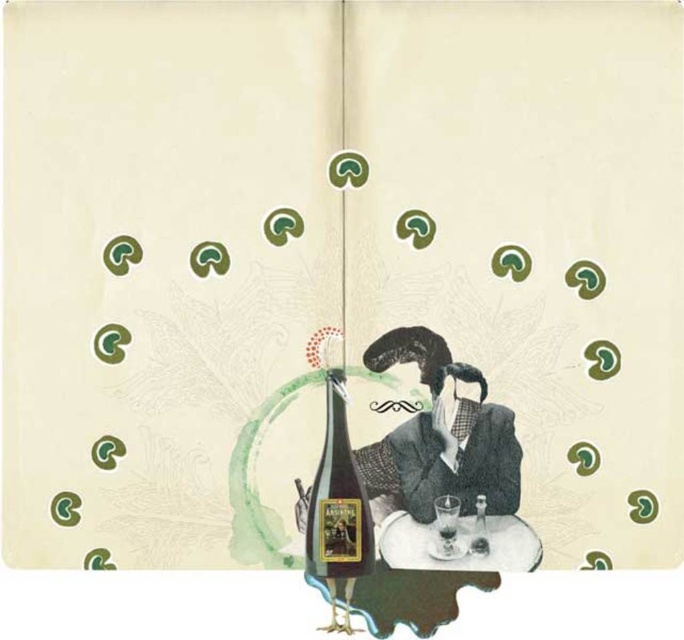
You are an artist analyzing the composition of this image. You notice the white wood table at center and the transparent glass at center. According to the spatial arrangement, which object is positioned to the right of the other?

The white wood table at center is to the right of the transparent glass at center.

You are a bartender preparing a drink. You have a transparent glass at center and a translucent glass bottle at center in front of you. Which one should you pour the liquid into first?

You should pour the liquid into the transparent glass at center first because it is bigger than the translucent glass bottle at center, making it more suitable for serving the drink.